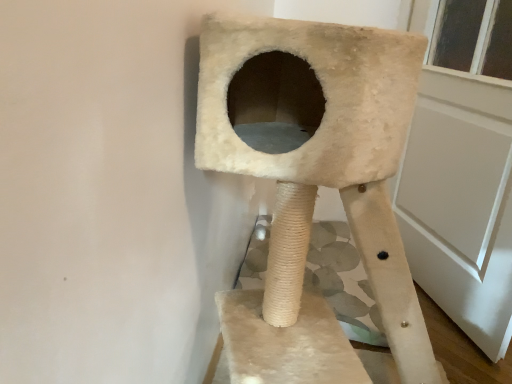
Question: Is white matte screen door at right further to camera compared to beige furry cat tree at center?

Choices:
 (A) yes
 (B) no

Answer: (A)

Question: From a real-world perspective, is white matte screen door at right positioned under beige furry cat tree at center based on gravity?

Choices:
 (A) no
 (B) yes

Answer: (A)

Question: Is white matte screen door at right beside beige furry cat tree at center?

Choices:
 (A) no
 (B) yes

Answer: (A)

Question: Could you tell me if white matte screen door at right is facing beige furry cat tree at center?

Choices:
 (A) no
 (B) yes

Answer: (A)

Question: From the image's perspective, does white matte screen door at right appear lower than beige furry cat tree at center?

Choices:
 (A) no
 (B) yes

Answer: (A)

Question: Is white matte screen door at right positioned with its back to beige furry cat tree at center?

Choices:
 (A) yes
 (B) no

Answer: (A)

Question: Is beige furry cat tree at center thinner than white matte screen door at right?

Choices:
 (A) no
 (B) yes

Answer: (A)

Question: Does beige furry cat tree at center have a larger size compared to white matte screen door at right?

Choices:
 (A) no
 (B) yes

Answer: (B)

Question: From a real-world perspective, is beige furry cat tree at center physically above white matte screen door at right?

Choices:
 (A) no
 (B) yes

Answer: (A)

Question: Is the position of beige furry cat tree at center less distant than that of white matte screen door at right?

Choices:
 (A) yes
 (B) no

Answer: (A)

Question: Considering the relative sizes of beige furry cat tree at center and white matte screen door at right in the image provided, is beige furry cat tree at center wider than white matte screen door at right?

Choices:
 (A) no
 (B) yes

Answer: (B)

Question: Considering the relative sizes of beige furry cat tree at center and white matte screen door at right in the image provided, is beige furry cat tree at center smaller than white matte screen door at right?

Choices:
 (A) yes
 (B) no

Answer: (B)

Question: Is point (414, 142) closer or farther from the camera than point (396, 281)?

Choices:
 (A) farther
 (B) closer

Answer: (A)